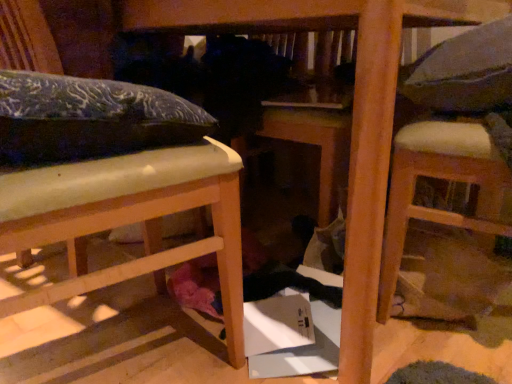
Question: Considering the relative sizes of matte wood bed at left, the 2th furniture when ordered from right to left, and gray fabric pillow at upper right in the image provided, is matte wood bed at left, the 2th furniture when ordered from right to left, bigger than gray fabric pillow at upper right?

Choices:
 (A) no
 (B) yes

Answer: (B)

Question: From a real-world perspective, is matte wood bed at left, the first furniture positioned from the left, below gray fabric pillow at upper right?

Choices:
 (A) yes
 (B) no

Answer: (A)

Question: Considering the relative sizes of matte wood bed at left, the first furniture positioned from the left, and gray fabric pillow at upper right in the image provided, is matte wood bed at left, the first furniture positioned from the left, shorter than gray fabric pillow at upper right?

Choices:
 (A) yes
 (B) no

Answer: (B)

Question: Could you tell me if matte wood bed at left, the 2th furniture when ordered from right to left, is facing gray fabric pillow at upper right?

Choices:
 (A) yes
 (B) no

Answer: (A)

Question: Considering the relative sizes of matte wood bed at left, the first furniture positioned from the left, and gray fabric pillow at upper right in the image provided, is matte wood bed at left, the first furniture positioned from the left, smaller than gray fabric pillow at upper right?

Choices:
 (A) no
 (B) yes

Answer: (A)

Question: Is matte wood bed at left, the first furniture positioned from the left, positioned with its back to gray fabric pillow at upper right?

Choices:
 (A) yes
 (B) no

Answer: (B)

Question: Is white padded chair at right, the 2th furniture viewed from the left, inside gray fabric pillow at upper right?

Choices:
 (A) yes
 (B) no

Answer: (B)

Question: Is gray fabric pillow at upper right looking in the opposite direction of white padded chair at right, marked as the 1th furniture in a right-to-left arrangement?

Choices:
 (A) yes
 (B) no

Answer: (A)

Question: Does gray fabric pillow at upper right come behind white padded chair at right, the 2th furniture viewed from the left?

Choices:
 (A) yes
 (B) no

Answer: (A)

Question: Is gray fabric pillow at upper right bigger than white padded chair at right, marked as the 1th furniture in a right-to-left arrangement?

Choices:
 (A) yes
 (B) no

Answer: (B)

Question: From the image's perspective, is gray fabric pillow at upper right located above white padded chair at right, marked as the 1th furniture in a right-to-left arrangement?

Choices:
 (A) no
 (B) yes

Answer: (B)

Question: From a real-world perspective, is gray fabric pillow at upper right on white padded chair at right, the 2th furniture viewed from the left?

Choices:
 (A) yes
 (B) no

Answer: (A)

Question: Is matte blue pillow at upper left to the right of white padded chair at right, the 2th furniture viewed from the left, from the viewer's perspective?

Choices:
 (A) no
 (B) yes

Answer: (A)